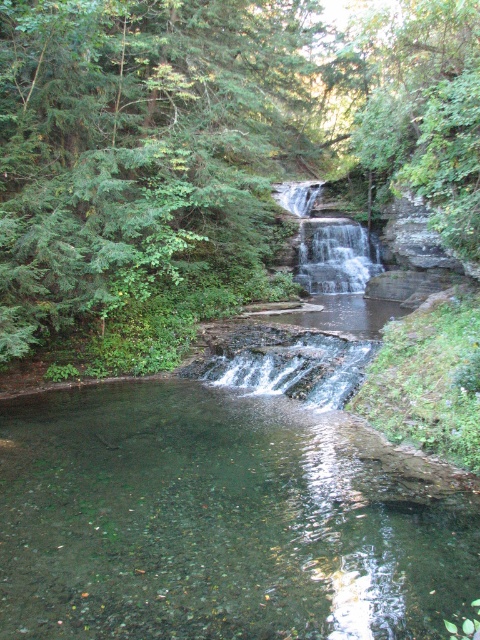
Question: Which object is positioned closest to the clear water at center?

Choices:
 (A) green leafy tree at center
 (B) clear glass stream at center

Answer: (A)

Question: Is clear glass stream at center to the right of clear water at center from the viewer's perspective?

Choices:
 (A) yes
 (B) no

Answer: (B)

Question: Does clear glass stream at center have a greater width compared to clear water at center?

Choices:
 (A) no
 (B) yes

Answer: (A)

Question: Observing the image, what is the correct spatial positioning of green leafy tree at center in reference to clear glass stream at center?

Choices:
 (A) below
 (B) above

Answer: (B)

Question: Which point appears farthest from the camera in this image?

Choices:
 (A) (19, 244)
 (B) (332, 611)

Answer: (A)

Question: Based on their relative distances, which object is nearer to the green leafy tree at center?

Choices:
 (A) clear water at center
 (B) clear glass stream at center

Answer: (A)